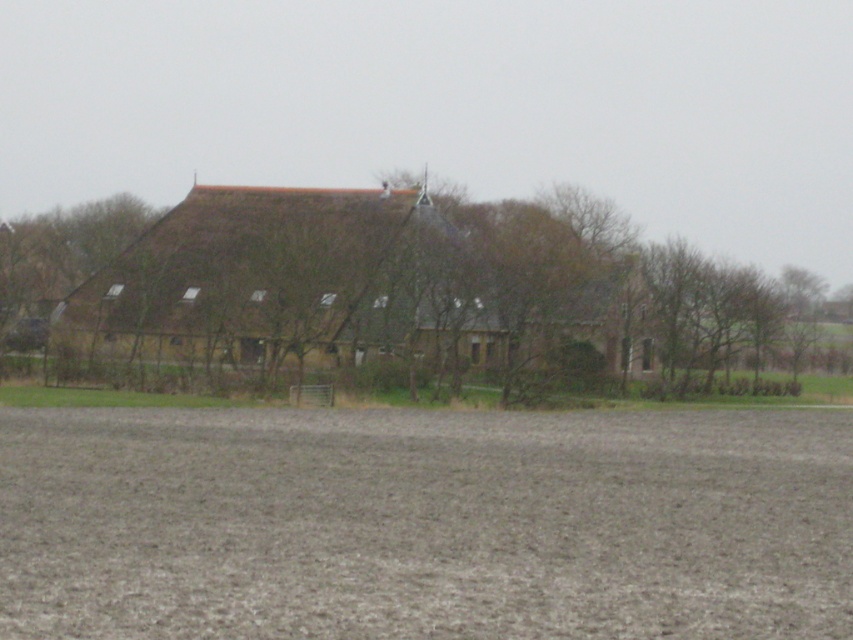
You are standing in front of the building and want to determine the relative positions of two points in the scene. Which of the two points, point (x=50, y=538) or point (x=369, y=269), is closer to you?

Point (x=50, y=538) is closer to the viewer than point (x=369, y=269).

Looking at this image, you are a farmer planning to plant crops in the brown soil at lower center. The brown thatched roof at center is part of your barn. If you want to ensure your tractor can move freely between the two areas, which area is wider and can accommodate the tractor better?

The brown thatched roof at center is wider than the brown soil at lower center, so it can accommodate the tractor better.

You are standing in the field in front of the building and want to plant a tree. The brown soil at lower center is located at point (424, 524). Where should you plant the tree to ensure it has enough space to grow without being too close to the building?

The brown soil at lower center is located at point (424, 524), so you should plant the tree there to ensure it has enough space to grow away from the building.